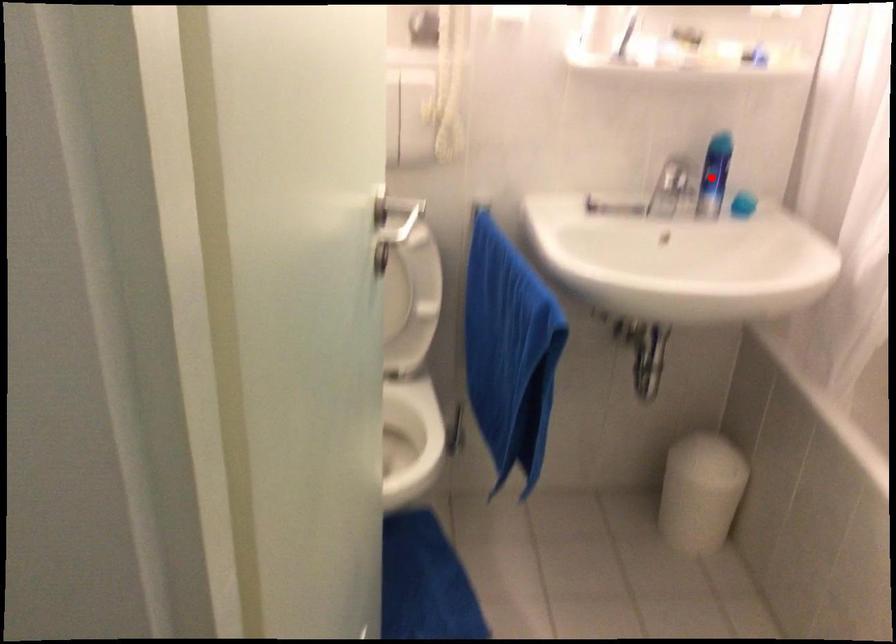
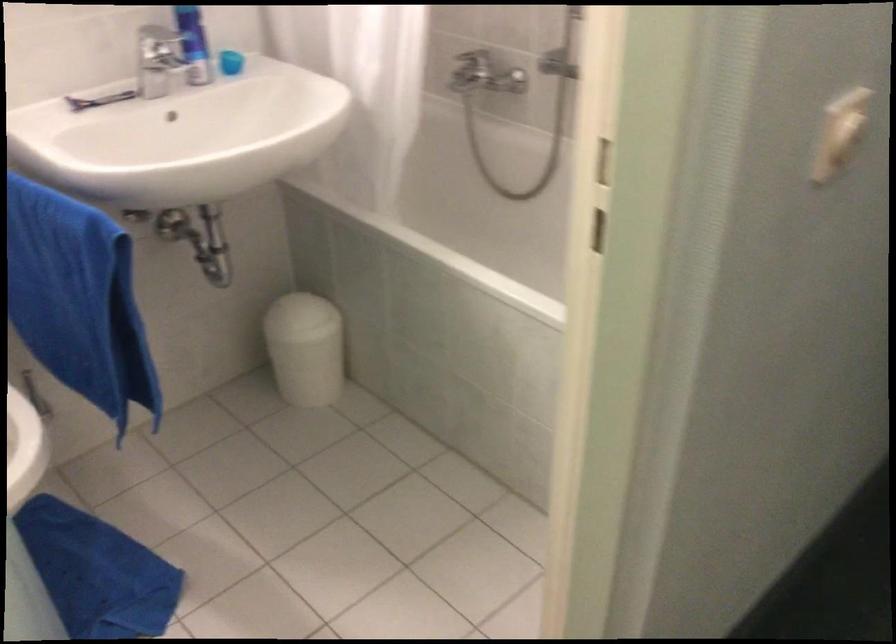
The point at the highlighted location is marked in the first image. Where is the corresponding point in the second image?

(194, 44)